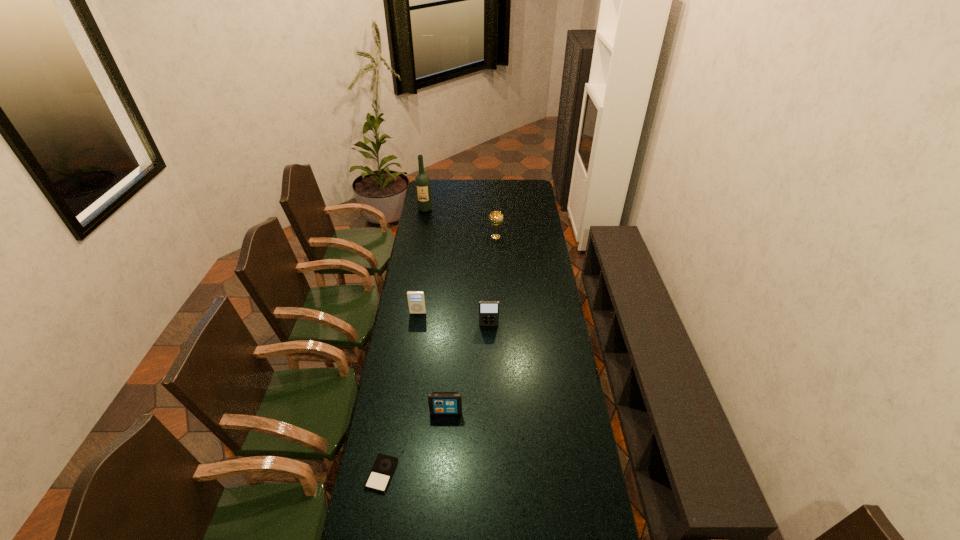
Where is `free spot located on the labeled side of the farthest object`? The width and height of the screenshot is (960, 540). free spot located on the labeled side of the farthest object is located at coordinates (422, 222).

Find the location of a particular element. vacant space located on the right of the second farthest object is located at coordinates (517, 237).

Where is `free space located 0.290m on the front-facing side of the second farthest iPod`? The width and height of the screenshot is (960, 540). free space located 0.290m on the front-facing side of the second farthest iPod is located at coordinates (490, 381).

Where is `blank space located on the front-facing side of the farthest iPod`? This screenshot has height=540, width=960. blank space located on the front-facing side of the farthest iPod is located at coordinates (414, 341).

Identify the location of vacant space located 0.370m on the front screen of the fifth farthest object. This screenshot has width=960, height=540. (439, 524).

The image size is (960, 540). Identify the location of vacant space situated on the front of the shortest iPod. (372, 535).

Where is `wine bottle at the left edge`? The height and width of the screenshot is (540, 960). wine bottle at the left edge is located at coordinates (422, 182).

This screenshot has width=960, height=540. I want to click on vacant space at the far edge of the desktop, so click(494, 193).

Identify the location of vacant space at the left edge. This screenshot has width=960, height=540. (398, 307).

The width and height of the screenshot is (960, 540). I want to click on free space at the right edge of the desktop, so click(x=575, y=455).